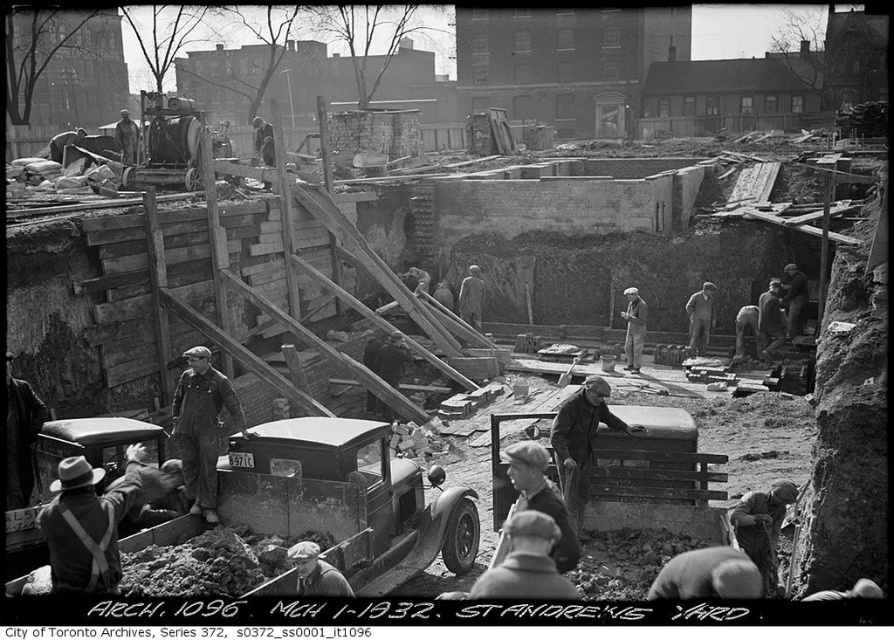
You are a construction worker who just arrived at the site and need to retrieve your rusty metal shovel at lower right. Considering the safety protocols, you must stay at least 50 feet away from the edge of the construction area to avoid potential hazards. Can you safely reach your shovel without violating the safety distance?

The rusty metal shovel at lower right is located 47.25 feet away from the viewer. Since the safety protocol requires staying at least 50 feet away from the edge, the worker cannot safely retrieve the shovel without violating the safety distance.

Please describe the location of the dark gray wool jacket at lower center in the image using coordinates.

The dark gray wool jacket at lower center is located at coordinates point (526, 563).